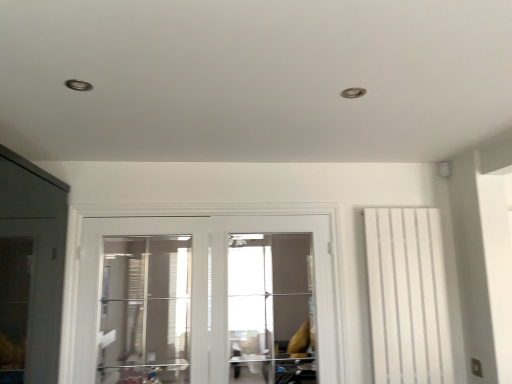
Question: Considering the positions of white matte radiator at right and white glossy door at center in the image, is white matte radiator at right bigger or smaller than white glossy door at center?

Choices:
 (A) big
 (B) small

Answer: (B)

Question: From a real-world perspective, is white matte radiator at right positioned above or below white glossy door at center?

Choices:
 (A) above
 (B) below

Answer: (B)

Question: Which object is the closest to the white matte radiator at right?

Choices:
 (A) transparent glass door at center
 (B) transparent glass screen door at center
 (C) white glossy door at center

Answer: (C)

Question: Which of these objects is positioned farthest from the transparent glass screen door at center?

Choices:
 (A) white matte radiator at right
 (B) white glossy door at center
 (C) transparent glass door at center

Answer: (A)